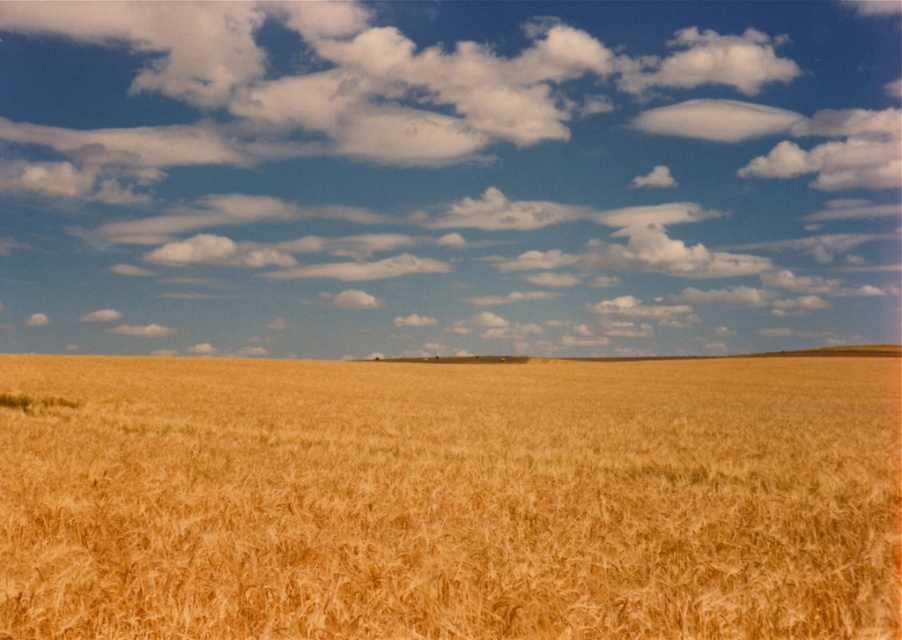
Is white fluffy cloud at upper center above golden matte wheat field at center?

Indeed, white fluffy cloud at upper center is positioned over golden matte wheat field at center.

Measure the distance between white fluffy cloud at upper center and golden matte wheat field at center.

white fluffy cloud at upper center and golden matte wheat field at center are 59.55 meters apart.

Is point (656, 276) farther from viewer compared to point (53, 376)?

That is True.

Where is `white fluffy cloud at upper center`? The image size is (902, 640). white fluffy cloud at upper center is located at coordinates (448, 177).